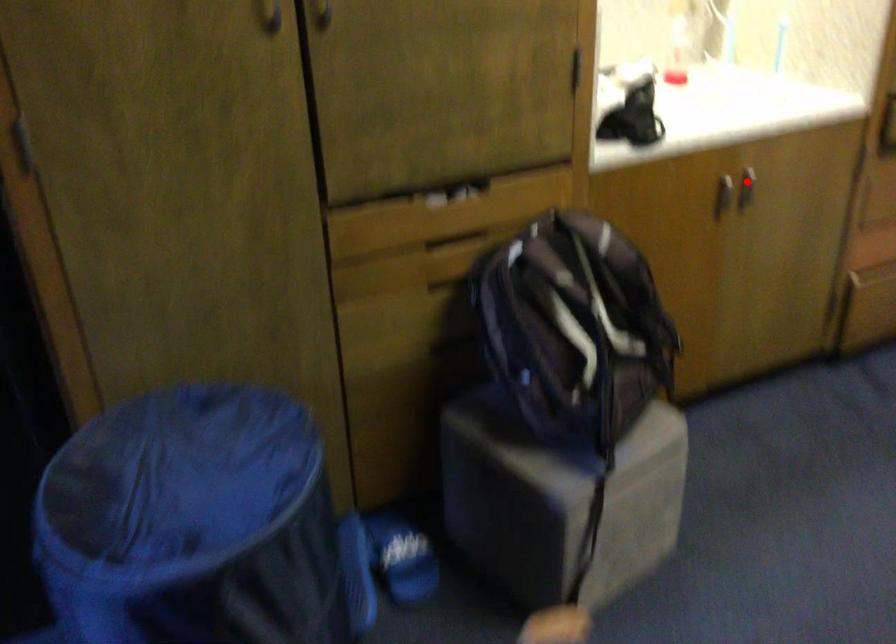
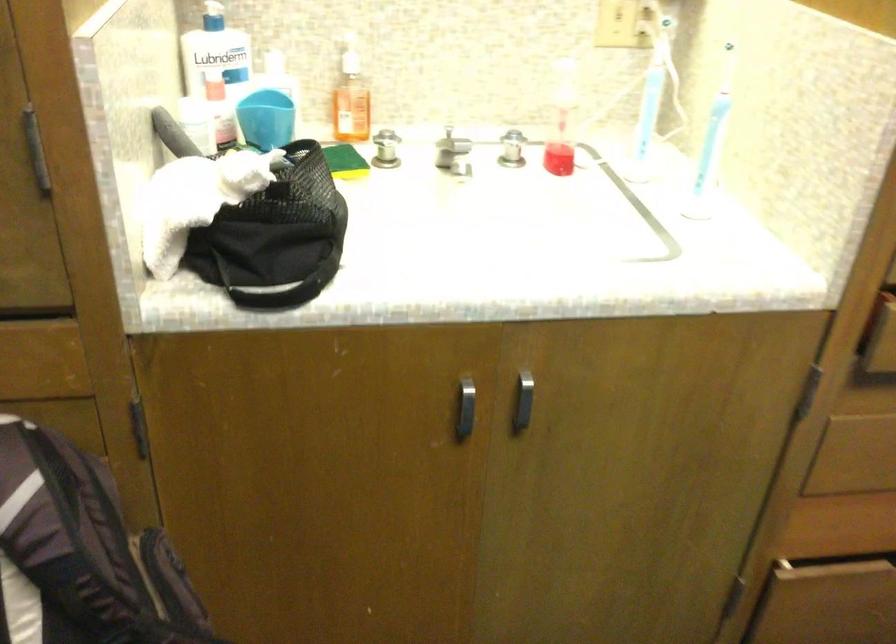
Question: I am providing you with two images of the same scene from different viewpoints. Image1 has a red point marked. In image2, the corresponding 3D location appears at what relative position? Reply with the corresponding letter.

Choices:
 (A) Closer
 (B) Farther

Answer: (A)